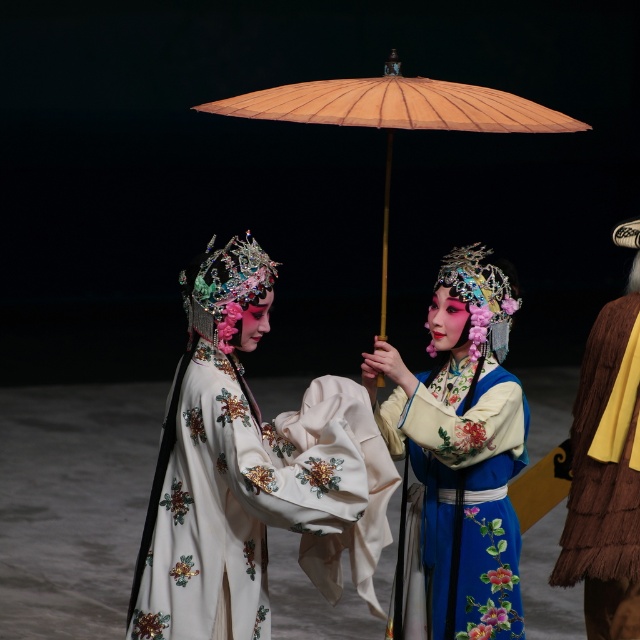
Is white satin dress at center positioned in front of matte beige parasol at center?

No, it is behind matte beige parasol at center.

Measure the distance between white satin dress at center and matte beige parasol at center.

1.14 meters

At what (x,y) coordinates should I click in order to perform the action: click on white satin dress at center. Please return your answer as a coordinate pair (x, y). This screenshot has height=640, width=640. Looking at the image, I should click on (227, 468).

Between blue silk robe at center and matte beige parasol at center, which one appears on the right side from the viewer's perspective?

blue silk robe at center is more to the right.

Is blue silk robe at center positioned in front of matte beige parasol at center?

No, it is behind matte beige parasol at center.

You are a GUI agent. You are given a task and a screenshot of the screen. Output one action in this format:
    pyautogui.click(x=<x>, y=<y>)
    Task: Click on the blue silk robe at center
    
    Given the screenshot: What is the action you would take?
    pyautogui.click(x=461, y=449)

Can you confirm if blue silk robe at center is positioned below brown fuzzy coat at right?

Actually, blue silk robe at center is above brown fuzzy coat at right.

Which is above, blue silk robe at center or brown fuzzy coat at right?

Positioned higher is blue silk robe at center.

Locate an element on the screen. The image size is (640, 640). blue silk robe at center is located at coordinates (461, 449).